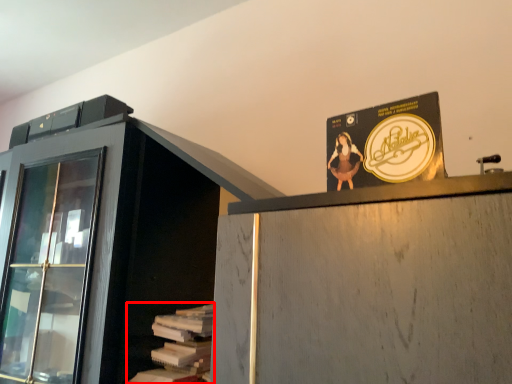
Question: In this image, where is book (annotated by the red box) located relative to advertisement?

Choices:
 (A) left
 (B) right

Answer: (A)